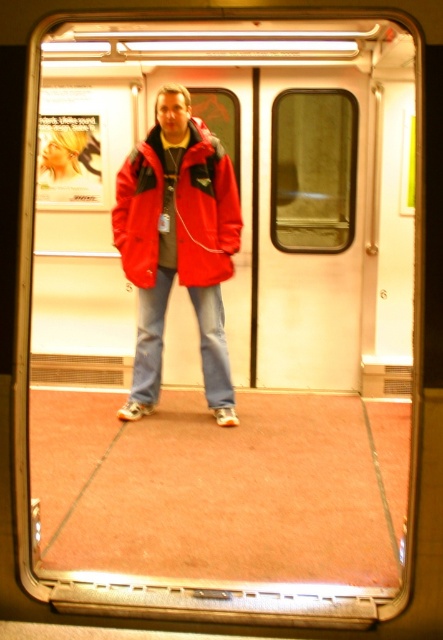
Consider the image. Does white matte door at center have a larger size compared to matte nylon jacket at center?

Yes.

Which of these two, white matte door at center or matte nylon jacket at center, stands shorter?

Standing shorter between the two is matte nylon jacket at center.

Which is behind, point (349, 74) or point (218, 154)?

The point (349, 74) is more distant.

The height and width of the screenshot is (640, 443). I want to click on white matte door at center, so click(310, 227).